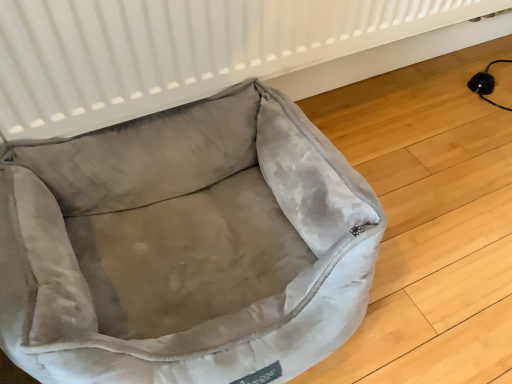
Question: Should I look upward or downward to see white textured radiator at upper center?

Choices:
 (A) down
 (B) up

Answer: (B)

Question: Is white textured radiator at upper center located outside velvet-like beige dog bed at lower left?

Choices:
 (A) yes
 (B) no

Answer: (A)

Question: Can you confirm if white textured radiator at upper center is shorter than velvet-like beige dog bed at lower left?

Choices:
 (A) no
 (B) yes

Answer: (A)

Question: Does white textured radiator at upper center have a larger size compared to velvet-like beige dog bed at lower left?

Choices:
 (A) yes
 (B) no

Answer: (B)

Question: From the image's perspective, is white textured radiator at upper center beneath velvet-like beige dog bed at lower left?

Choices:
 (A) yes
 (B) no

Answer: (B)

Question: Is white textured radiator at upper center beside velvet-like beige dog bed at lower left?

Choices:
 (A) yes
 (B) no

Answer: (B)

Question: Does white textured radiator at upper center come behind velvet-like beige dog bed at lower left?

Choices:
 (A) yes
 (B) no

Answer: (A)

Question: Can you confirm if velvet-like beige dog bed at lower left is shorter than white textured radiator at upper center?

Choices:
 (A) yes
 (B) no

Answer: (A)

Question: Is velvet-like beige dog bed at lower left far away from white textured radiator at upper center?

Choices:
 (A) yes
 (B) no

Answer: (B)

Question: Can you confirm if velvet-like beige dog bed at lower left is taller than white textured radiator at upper center?

Choices:
 (A) yes
 (B) no

Answer: (B)

Question: Is velvet-like beige dog bed at lower left positioned beyond the bounds of white textured radiator at upper center?

Choices:
 (A) no
 (B) yes

Answer: (B)

Question: Is velvet-like beige dog bed at lower left turned away from white textured radiator at upper center?

Choices:
 (A) yes
 (B) no

Answer: (B)

Question: From a real-world perspective, is velvet-like beige dog bed at lower left over white textured radiator at upper center?

Choices:
 (A) no
 (B) yes

Answer: (A)

Question: Is white textured radiator at upper center wider or thinner than velvet-like beige dog bed at lower left?

Choices:
 (A) thin
 (B) wide

Answer: (A)